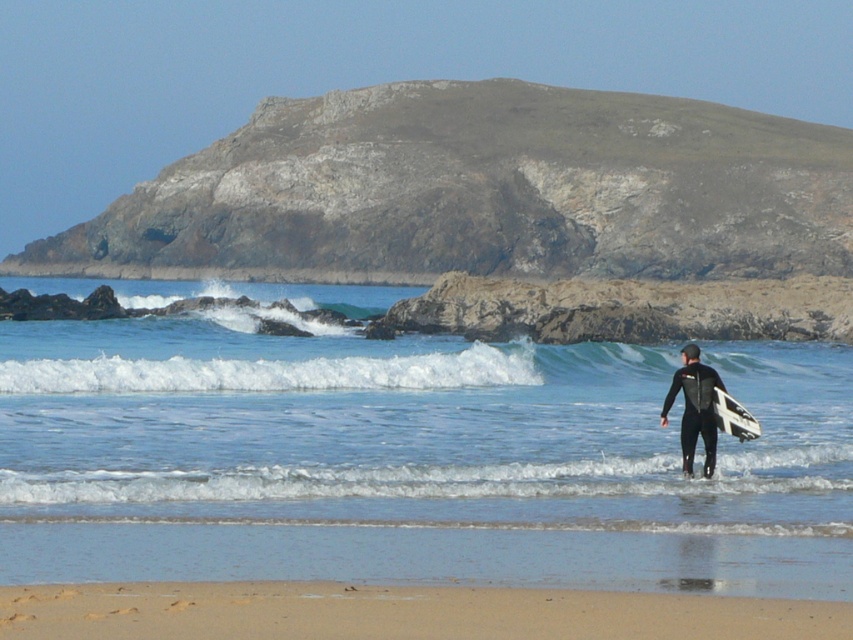
You are a photographer standing on the beach and want to capture the black wetsuit at center and the clear blue water at center in the same frame. Which object should you position closer to the left side of your camera viewfinder to include both?

To include both the black wetsuit at center and the clear blue water at center in the same frame, you should position the clear blue water at center closer to the left side of your camera viewfinder since it is already on the left side of the black wetsuit at center.

You are standing on the sandy beach at lower center and want to reach the black wetsuit at center. Which direction should you walk to get there?

You should walk to the right because the black wetsuit at center is to the right of the sandy beach at lower center.